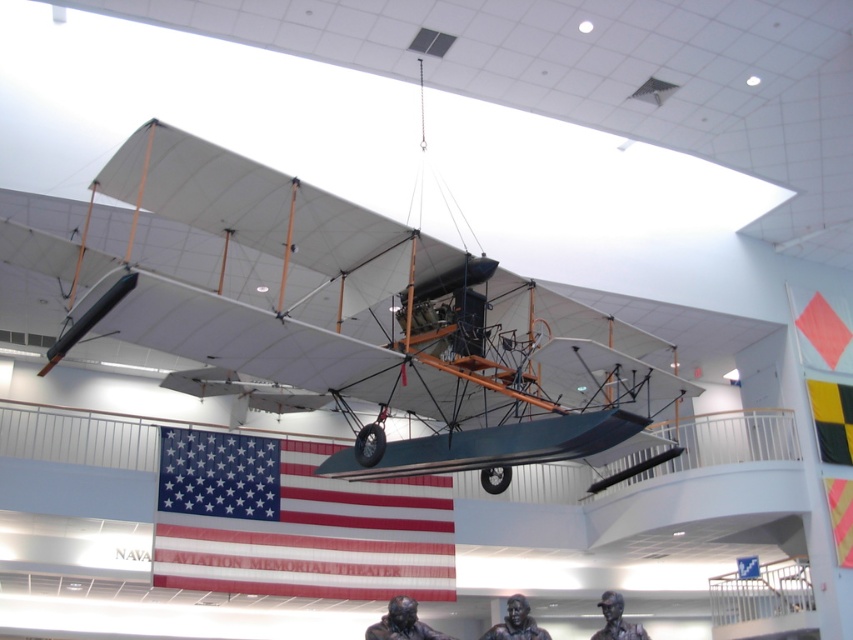
Question: Where is matte white airplane at center located in relation to american flag at center in the image?

Choices:
 (A) right
 (B) left

Answer: (A)

Question: Observing the image, what is the correct spatial positioning of american flag at center in reference to yellowmaterial/textureflag at upper right?

Choices:
 (A) below
 (B) above

Answer: (A)

Question: Estimate the real-world distances between objects in this image. Which object is closer to the yellow fabric flag at center?

Choices:
 (A) american flag at center
 (B) matte white airplane at center

Answer: (B)

Question: Which object appears farthest from the camera in this image?

Choices:
 (A) yellow fabric flag at center
 (B) american flag at center

Answer: (A)

Question: Does american flag at center appear on the left side of yellowmaterial/textureflag at upper right?

Choices:
 (A) yes
 (B) no

Answer: (A)

Question: Which of the following is the farthest from the observer?

Choices:
 (A) (842, 406)
 (B) (154, 529)
 (C) (850, 516)
 (D) (572, 337)

Answer: (A)